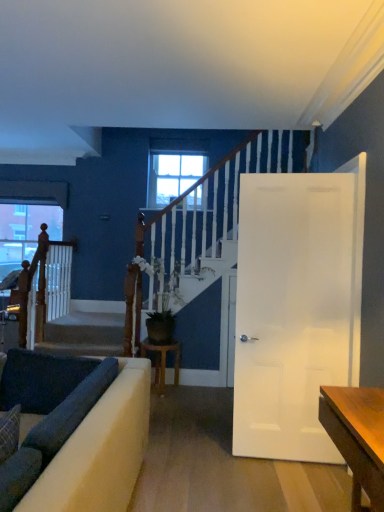
Question: Is point (64, 357) positioned closer to the camera than point (99, 327)?

Choices:
 (A) closer
 (B) farther

Answer: (A)

Question: From a real-world perspective, is dark fabric cushion at lower left physically located above or below smooth concrete stairs at center?

Choices:
 (A) above
 (B) below

Answer: (A)

Question: Estimate the real-world distances between objects in this image. Which object is closer to the green leafy plant at center?

Choices:
 (A) clear glass window at center, acting as the second window starting from the bottom
 (B) dark fabric cushion at lower left
 (C) white glossy door at right
 (D) velvet dark blue sofa at lower left
 (E) wooden stool at center

Answer: (E)

Question: Which of these objects is positioned farthest from the transparent glass window at upper left, the first window from the left?

Choices:
 (A) smooth concrete stairs at center
 (B) clear glass window at center, which ranks as the first window in front-to-back order
 (C) green leafy plant at center
 (D) white glossy door at right
 (E) velvet dark blue sofa at lower left

Answer: (D)